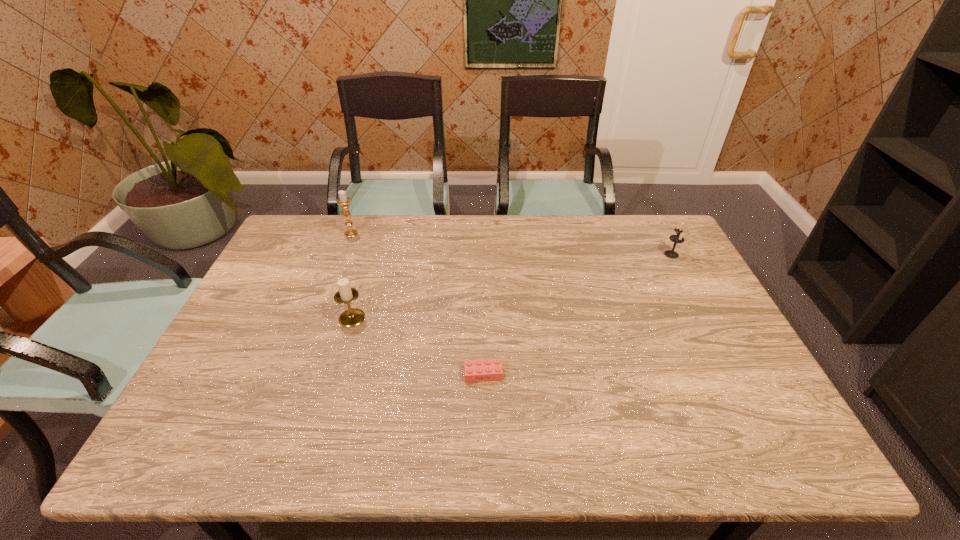
In order to click on the third closest object to the second nearest object in this screenshot , I will do `click(678, 238)`.

Identify the location of object that stands as the second closest to the third object from right to left. (343, 200).

Find the location of `candle holder identified as the closest to the tallest object`. candle holder identified as the closest to the tallest object is located at coordinates (345, 295).

This screenshot has height=540, width=960. I want to click on candle holder that stands as the second closest to the second object from left to right, so click(x=678, y=238).

Locate an element on the screen. This screenshot has height=540, width=960. free region that satisfies the following two spatial constraints: 1. on the back side of the rightmost object; 2. on the right side of the third farthest object is located at coordinates (372, 254).

Locate an element on the screen. This screenshot has height=540, width=960. free location that satisfies the following two spatial constraints: 1. on the front side of the leftmost object; 2. on the left side of the third object from right to left is located at coordinates (320, 318).

At what (x,y) coordinates should I click in order to perform the action: click on free location that satisfies the following two spatial constraints: 1. on the front side of the Lego; 2. on the right side of the second nearest object. Please return your answer as a coordinate pair (x, y). This screenshot has height=540, width=960. Looking at the image, I should click on (335, 374).